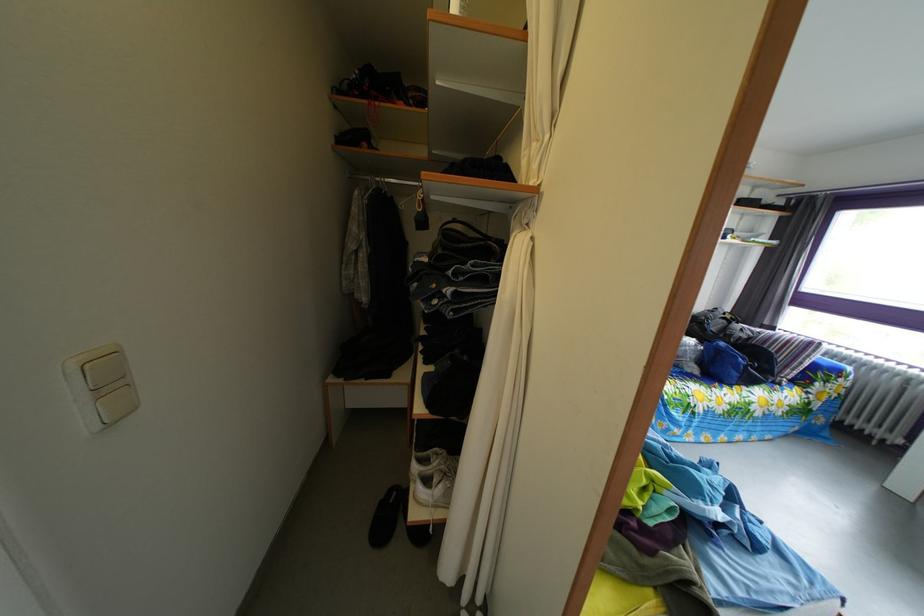
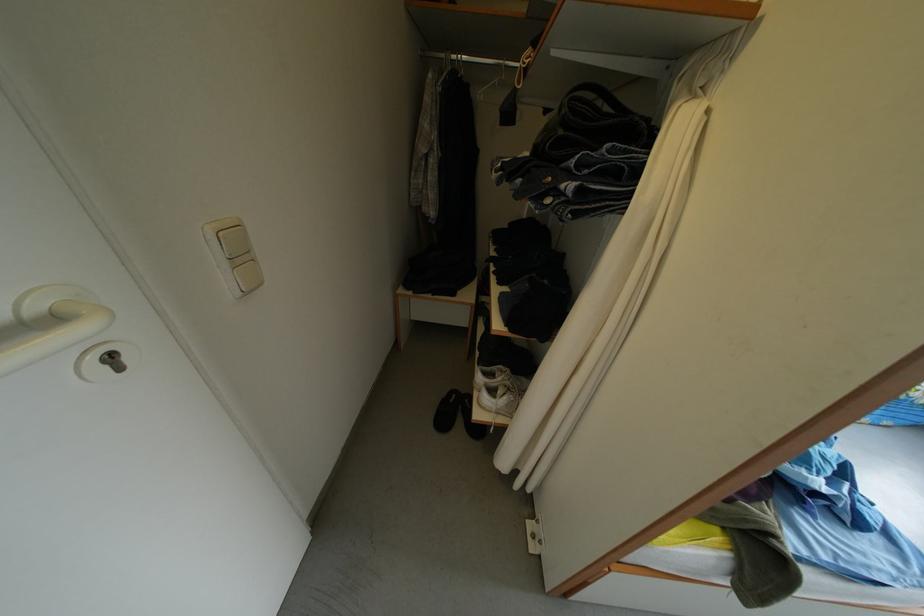
Where in the second image is the point corresponding to [394,513] from the first image?

(456, 411)